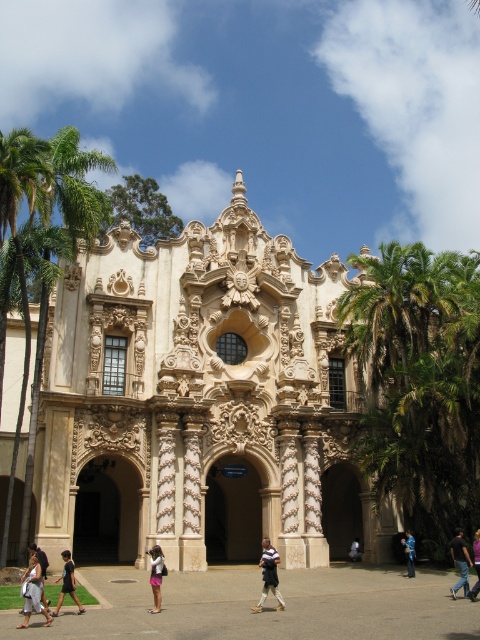
Is beige stone church at center above green leafy palm tree at right?

Correct, beige stone church at center is located above green leafy palm tree at right.

Is beige stone church at center positioned behind green leafy palm tree at right?

No.

Is point (101, 492) farther from viewer compared to point (432, 468)?

Yes, point (101, 492) is farther from viewer.

Find the location of a particular element. This screenshot has height=640, width=480. beige stone church at center is located at coordinates (201, 403).

In order to click on denim pants at lower right in this screenshot , I will do `click(459, 563)`.

What do you see at coordinates (459, 563) in the screenshot? The width and height of the screenshot is (480, 640). I see `denim pants at lower right` at bounding box center [459, 563].

You are a GUI agent. You are given a task and a screenshot of the screen. Output one action in this format:
    pyautogui.click(x=<x>, y=<y>)
    Task: Click on the denim pants at lower right
    
    Given the screenshot: What is the action you would take?
    pyautogui.click(x=459, y=563)

Does white cotton dress at lower left have a larger size compared to white fabric pants at lower right?

Yes.

Is white cotton dress at lower left smaller than white fabric pants at lower right?

No.

In order to click on white cotton dress at lower left in this screenshot , I will do `click(34, 593)`.